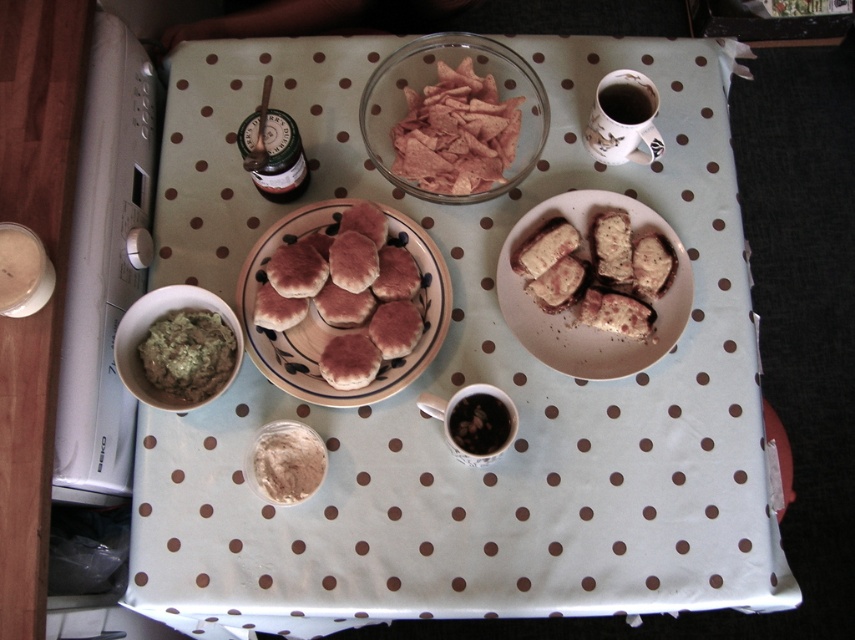
Can you confirm if light blue fabric at center is bigger than brown crumbly bread at center right?

Yes, light blue fabric at center is bigger than brown crumbly bread at center right.

Find the location of a particular element. The height and width of the screenshot is (640, 855). light blue fabric at center is located at coordinates (463, 381).

The image size is (855, 640). I want to click on light blue fabric at center, so click(x=463, y=381).

Can you confirm if light blue fabric at center is taller than pink matte pita bread at center?

Yes.

Who is taller, light blue fabric at center or pink matte pita bread at center?

With more height is light blue fabric at center.

What do you see at coordinates (463, 381) in the screenshot? This screenshot has height=640, width=855. I see `light blue fabric at center` at bounding box center [463, 381].

The image size is (855, 640). Identify the location of light blue fabric at center. (463, 381).

Can you confirm if pink matte pita bread at center is bigger than powdery beige powder at center?

Yes.

Does pink matte pita bread at center have a greater height compared to powdery beige powder at center?

Yes.

Does point (282, 237) come behind point (260, 476)?

Yes.

You are a GUI agent. You are given a task and a screenshot of the screen. Output one action in this format:
    pyautogui.click(x=<x>, y=<y>)
    Task: Click on the pink matte pita bread at center
    The width and height of the screenshot is (855, 640).
    Given the screenshot: What is the action you would take?
    pyautogui.click(x=337, y=291)